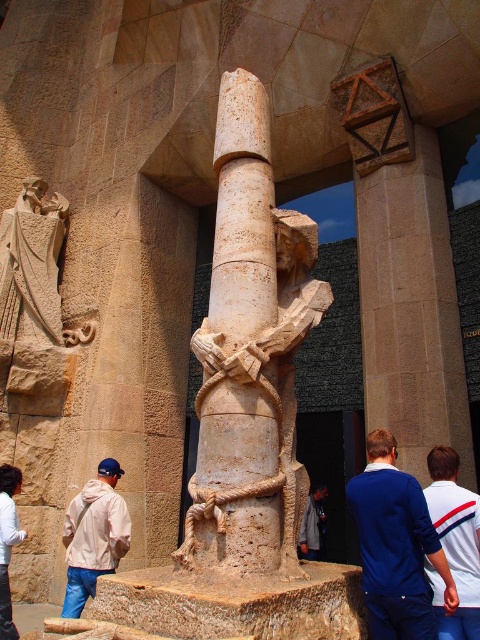
You are an artist standing in front of the stone column and want to sketch the blue cotton shirt at center and the beige fabric jacket at lower left. Which one should you focus on first to capture their spatial relationship accurately?

You should focus on the blue cotton shirt at center first because it is in front of the beige fabric jacket at lower left, so drawing it first will help establish the correct layering between the two objects.

You are an artist standing in front of the large stone structure. You notice the blue cotton shirt at center and the dark gray fabric at center. Which one has a greater width?

The blue cotton shirt at center might be wider than dark gray fabric at center, so it has a greater width.